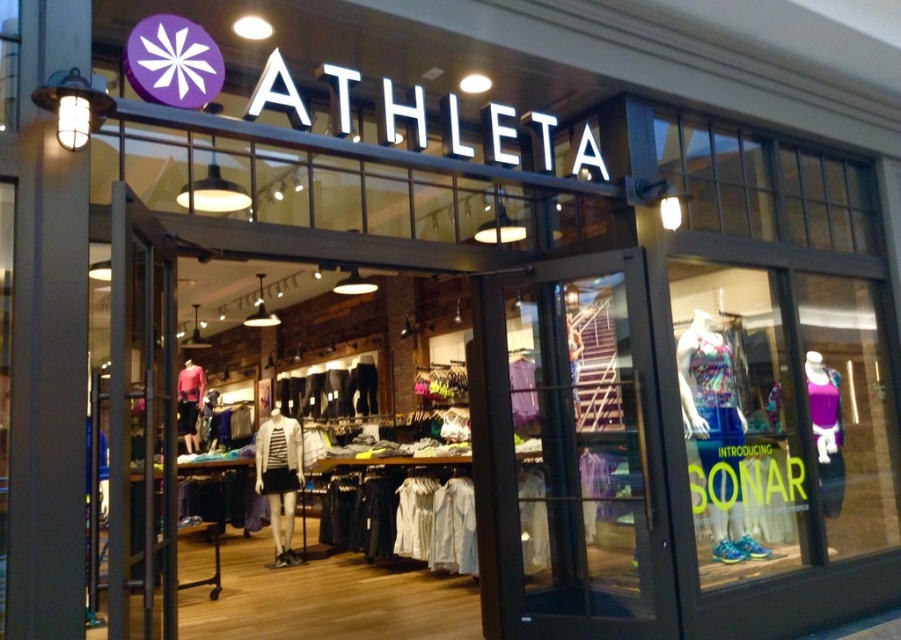
Can you confirm if black matte leggings at center is positioned above purple fabric tank top at right?

No, black matte leggings at center is not above purple fabric tank top at right.

Is point (348, 388) in front of point (827, 458)?

No, it is not.

This screenshot has width=901, height=640. Find the location of `black matte leggings at center`. black matte leggings at center is located at coordinates (330, 392).

Can you confirm if textured fabric dress at center is thinner than black matte leggings at center?

Indeed, textured fabric dress at center has a lesser width compared to black matte leggings at center.

Consider the image. Does textured fabric dress at center appear over black matte leggings at center?

Indeed, textured fabric dress at center is positioned over black matte leggings at center.

Between point (765, 288) and point (359, 406), which one is positioned behind?

The point (359, 406) is behind.

Where is `textured fabric dress at center`? The width and height of the screenshot is (901, 640). textured fabric dress at center is located at coordinates (736, 422).

Who is more forward, [822,419] or [290,426]?

Positioned in front is point [822,419].

Is point (815, 410) behind point (290, 432)?

No, it is not.

The height and width of the screenshot is (640, 901). Identify the location of purple fabric tank top at right. (826, 429).